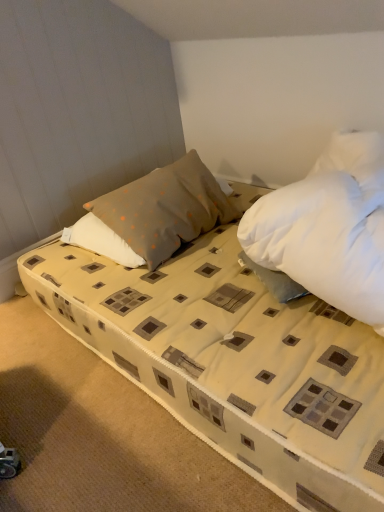
This screenshot has width=384, height=512. What do you see at coordinates (234, 362) in the screenshot?
I see `beige fabric bed at center` at bounding box center [234, 362].

The width and height of the screenshot is (384, 512). What are the coordinates of `beige fabric bed at center` in the screenshot? It's located at (234, 362).

You are a GUI agent. You are given a task and a screenshot of the screen. Output one action in this format:
    pyautogui.click(x=<x>, y=<y>)
    Task: Click on the gray dotted pillow at center
    This screenshot has width=384, height=512.
    Given the screenshot: What is the action you would take?
    pyautogui.click(x=165, y=208)

What do you see at coordinates (165, 208) in the screenshot?
I see `gray dotted pillow at center` at bounding box center [165, 208].

This screenshot has width=384, height=512. Identify the location of beige fabric bed at center. (234, 362).

Considering the relative positions of beige fabric bed at center and gray dotted pillow at center in the image provided, is beige fabric bed at center to the left or to the right of gray dotted pillow at center?

Clearly, beige fabric bed at center is on the right of gray dotted pillow at center in the image.

Which is in front, beige fabric bed at center or gray dotted pillow at center?

beige fabric bed at center is more forward.

Does point (255, 389) lie in front of point (160, 196)?

That is True.

From the image's perspective, which object appears higher, beige fabric bed at center or gray dotted pillow at center?

gray dotted pillow at center appears higher in the image.

From a real-world perspective, is beige fabric bed at center under gray dotted pillow at center?

Yes.

Which of these two, beige fabric bed at center or gray dotted pillow at center, is wider?

With larger width is beige fabric bed at center.

Considering the relative sizes of beige fabric bed at center and gray dotted pillow at center in the image provided, is beige fabric bed at center taller than gray dotted pillow at center?

No.

Does beige fabric bed at center have a larger size compared to gray dotted pillow at center?

Correct, beige fabric bed at center is larger in size than gray dotted pillow at center.

Is beige fabric bed at center spatially inside gray dotted pillow at center, or outside of it?

beige fabric bed at center lies outside gray dotted pillow at center.

Is beige fabric bed at center next to gray dotted pillow at center?

There is a gap between beige fabric bed at center and gray dotted pillow at center.

Is beige fabric bed at center oriented towards gray dotted pillow at center?

No, beige fabric bed at center is not oriented towards gray dotted pillow at center.

How different are the orientations of beige fabric bed at center and gray dotted pillow at center in degrees?

beige fabric bed at center and gray dotted pillow at center are facing 0.253 degrees away from each other.

The width and height of the screenshot is (384, 512). What are the coordinates of `bed located on the right of gray dotted pillow at center` in the screenshot? It's located at (234, 362).

Which object is positioned more to the right, gray dotted pillow at center or beige fabric bed at center?

beige fabric bed at center is more to the right.

Is gray dotted pillow at center closer to camera compared to beige fabric bed at center?

No, gray dotted pillow at center is further to the viewer.

Does point (116, 201) appear closer or farther from the camera than point (265, 423)?

Point (116, 201) is positioned farther from the camera compared to point (265, 423).

From the image's perspective, would you say gray dotted pillow at center is positioned over beige fabric bed at center?

Yes, from the image's perspective, gray dotted pillow at center is above beige fabric bed at center.

From a real-world perspective, is gray dotted pillow at center positioned above or below beige fabric bed at center?

gray dotted pillow at center is situated higher than beige fabric bed at center in the real world.

Does gray dotted pillow at center have a greater width compared to beige fabric bed at center?

Incorrect, the width of gray dotted pillow at center does not surpass that of beige fabric bed at center.

Which of these two, gray dotted pillow at center or beige fabric bed at center, stands taller?

gray dotted pillow at center is taller.

Does gray dotted pillow at center have a smaller size compared to beige fabric bed at center?

Correct, gray dotted pillow at center occupies less space than beige fabric bed at center.

Could beige fabric bed at center be considered to be inside gray dotted pillow at center?

No, beige fabric bed at center is not inside gray dotted pillow at center.

In the scene shown: Is there a large distance between gray dotted pillow at center and beige fabric bed at center?

That's not correct — gray dotted pillow at center is a little close to beige fabric bed at center.

Is gray dotted pillow at center turned away from beige fabric bed at center?

That's not correct — gray dotted pillow at center is not looking away from beige fabric bed at center.

Where is `bed in front of the gray dotted pillow at center`? This screenshot has width=384, height=512. bed in front of the gray dotted pillow at center is located at coordinates (234, 362).

Where is `pillow that appears above the beige fabric bed at center (from the image's perspective)`? The height and width of the screenshot is (512, 384). pillow that appears above the beige fabric bed at center (from the image's perspective) is located at coordinates (165, 208).

You are a GUI agent. You are given a task and a screenshot of the screen. Output one action in this format:
    pyautogui.click(x=<x>, y=<y>)
    Task: Click on the bed located in front of the gray dotted pillow at center
    This screenshot has height=512, width=384.
    Given the screenshot: What is the action you would take?
    pyautogui.click(x=234, y=362)